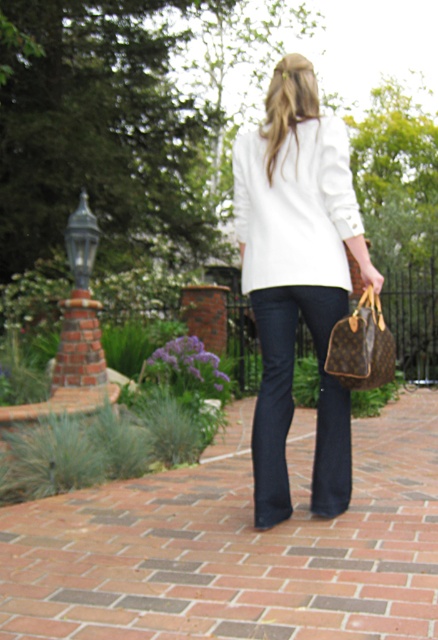
Is brick at center to the right of dark blue denim jeans at center from the viewer's perspective?

No, brick at center is not to the right of dark blue denim jeans at center.

Who is taller, brick at center or dark blue denim jeans at center?

dark blue denim jeans at center is taller.

Is point (129, 572) farther from camera compared to point (339, 508)?

No, (129, 572) is in front of (339, 508).

At what (x,y) coordinates should I click in order to perform the action: click on brick at center. Please return your answer as a coordinate pair (x, y). This screenshot has height=640, width=438. Looking at the image, I should click on (236, 545).

Which is below, brick at center or brown leather handbag at right?

brick at center

The height and width of the screenshot is (640, 438). I want to click on brick at center, so click(x=236, y=545).

Is point (281, 513) farther from camera compared to point (374, 365)?

That is True.

Is dark blue denim jeans at center further to the viewer compared to brown leather handbag at right?

Yes, dark blue denim jeans at center is behind brown leather handbag at right.

Is point (258, 317) less distant than point (335, 340)?

No, (258, 317) is further to viewer.

Find the location of `dark blue denim jeans at center`. dark blue denim jeans at center is located at coordinates (293, 403).